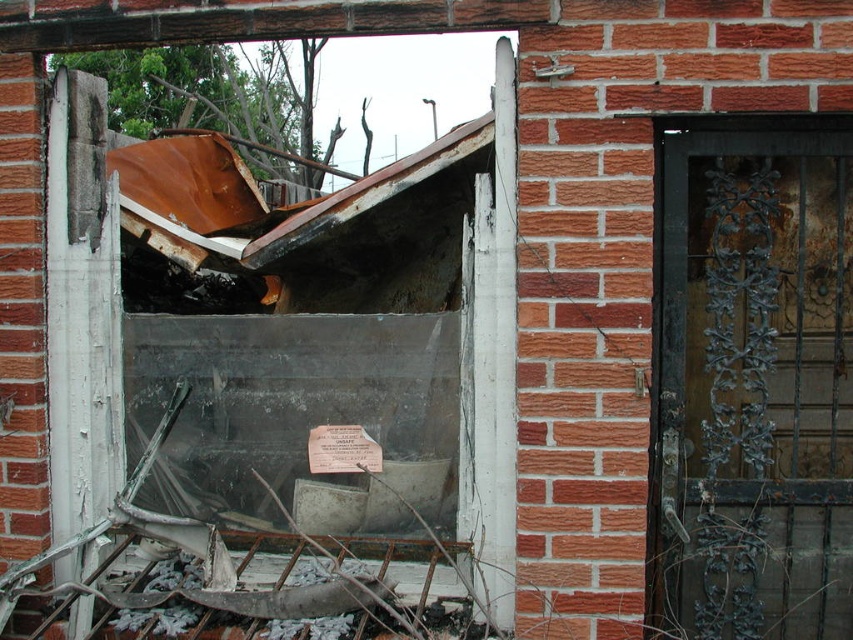
You are a safety inspector assessing the damage. You need to determine if the rusty metal window at center can be removed without destabilizing the rusty metal door at right. Knowing that the window is wider than the door, what should you consider?

The rusty metal window at center is wider than the rusty metal door at right. Removing the window may affect the structural integrity of the door since they are adjacent and the window is larger, potentially causing further instability.

You are a structural engineer assessing the damage. You notice the rusty metal window at center and the rusty metal door at right. Which one has a larger size according to the scene?

The rusty metal window at center is bigger than the rusty metal door at right, so the window has a larger size.